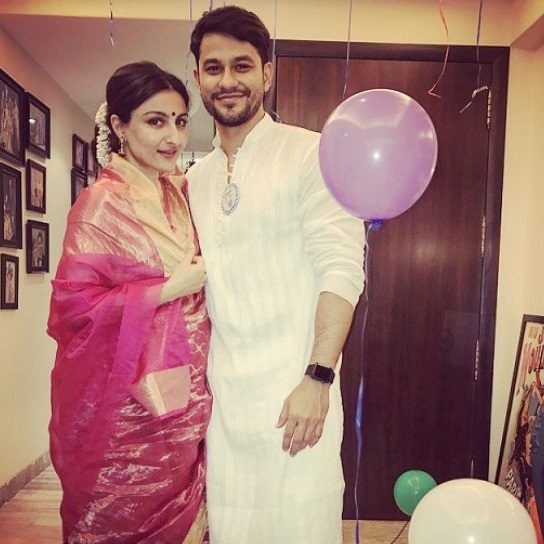
Where is `floor`? This screenshot has width=544, height=544. floor is located at coordinates (28, 523).